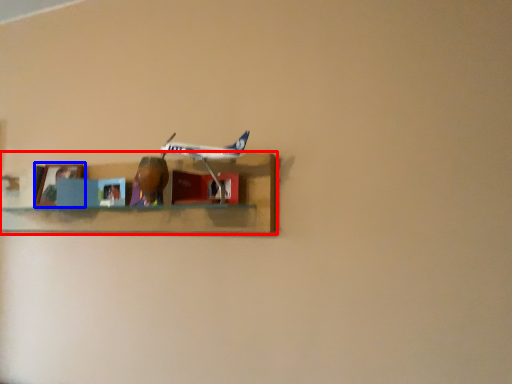
Question: Which object is closer to the camera taking this photo, shelf (highlighted by a red box) or picture frame (highlighted by a blue box)?

Choices:
 (A) shelf
 (B) picture frame

Answer: (A)